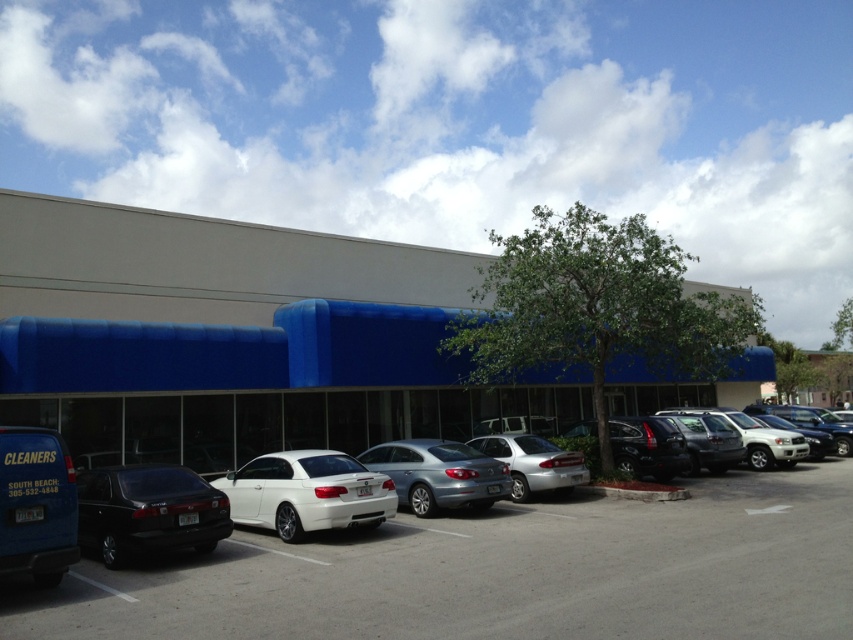
You are a delivery person trying to park your vehicle in the parking lot. You see a metallic silver car at center and a satin silver sedan at center. Which vehicle is blocking the entrance area under the blue awning?

The metallic silver car at center is positioned under the satin silver sedan at center, so the satin silver sedan at center is blocking the entrance area under the blue awning.

You are a delivery person trying to park your van in the parking lot. You see a metallic silver car at center and a satin silver sedan at center. Which vehicle should you move to the left to make space for your van?

You should move the satin silver sedan at center to the left because the metallic silver car at center is already to the right of it, so shifting the sedan left would create more space on the right side for the van.

You are standing at the entrance of the commercial building and want to locate the satin silver sedan at center. According to the parking lot layout, where would you find it?

The satin silver sedan at center is located at the point with coordinates 0.742 on the x axis and 0.516 on the y axis in the parking lot.